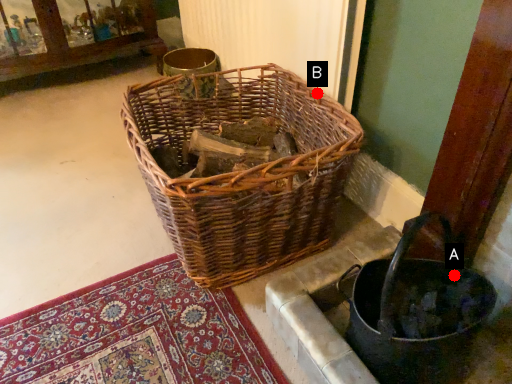
Question: Two points are circled on the image, labeled by A and B beside each circle. Which point is closer to the camera?

Choices:
 (A) A is closer
 (B) B is closer

Answer: (A)